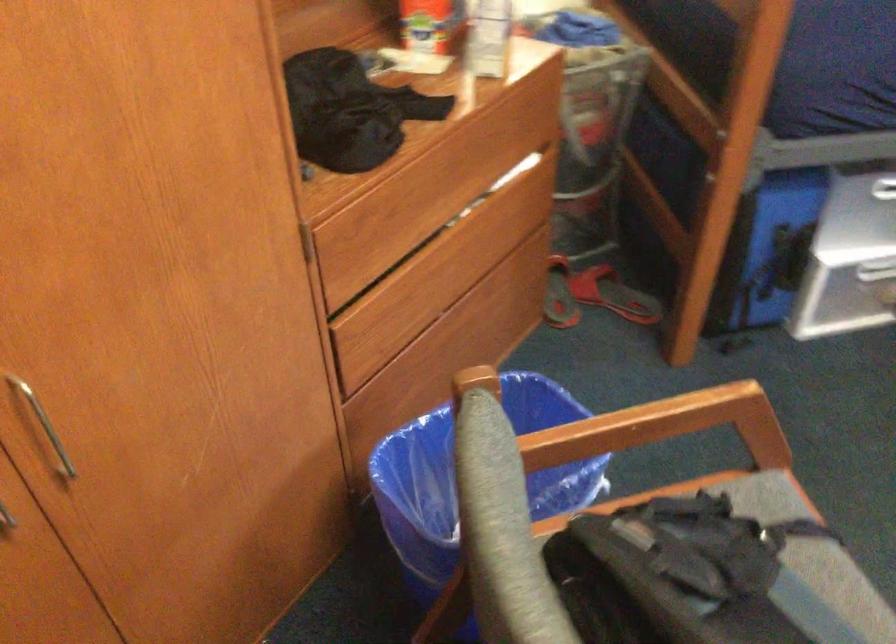
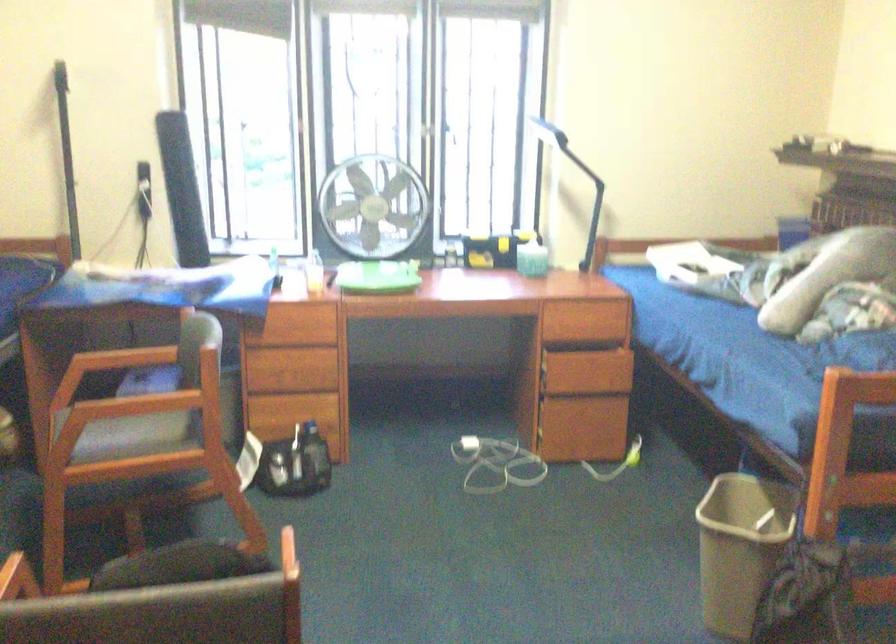
Question: The camera is either moving clockwise (left) or counter-clockwise (right) around the object. The first image is from the beginning of the video and the second image is from the end. Is the camera moving left or right when shooting the video?

Choices:
 (A) Left
 (B) Right

Answer: (A)